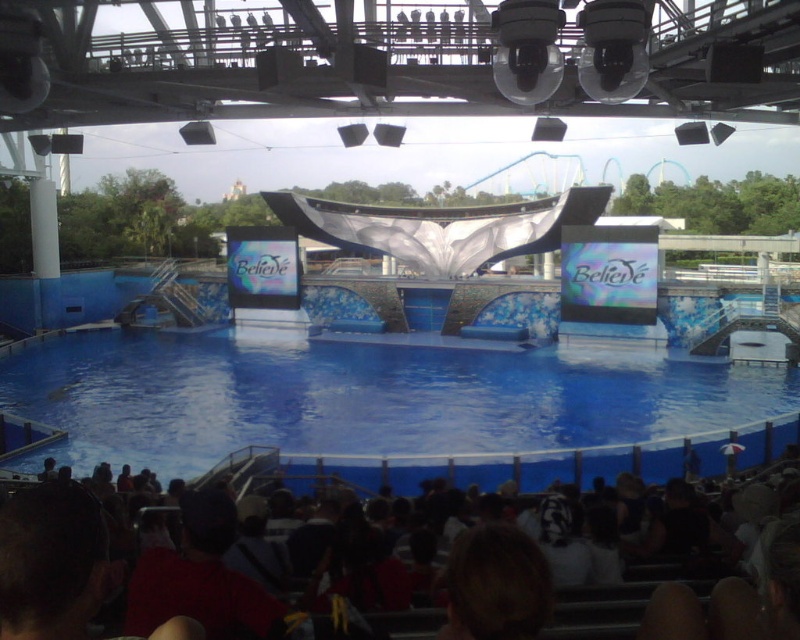
Question: Can you confirm if blue glossy water at center is positioned to the left of dark brown hair at lower center?

Choices:
 (A) no
 (B) yes

Answer: (B)

Question: Which of the following is the farthest from the observer?

Choices:
 (A) dark brown hair at lower center
 (B) blue glossy water at center

Answer: (B)

Question: Which point is farther from the camera taking this photo?

Choices:
 (A) (225, 348)
 (B) (92, 509)

Answer: (A)

Question: Does blue glossy water at center come behind dark brown hair at lower center?

Choices:
 (A) no
 (B) yes

Answer: (B)

Question: Which point appears farthest from the camera in this image?

Choices:
 (A) (509, 381)
 (B) (172, 621)

Answer: (A)

Question: Is blue glossy water at center closer to the viewer compared to dark brown hair at lower center?

Choices:
 (A) no
 (B) yes

Answer: (A)